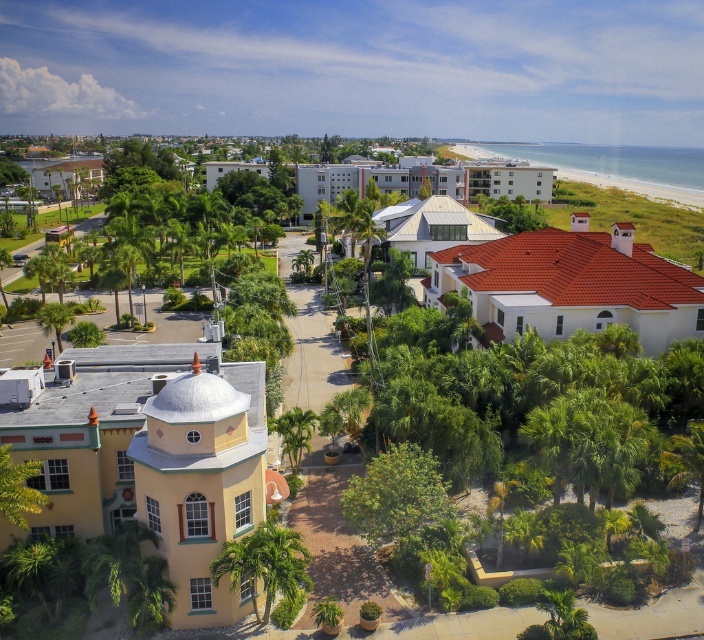
Question: Is white tile roof at upper right closer to the viewer compared to white concrete building at upper center?

Choices:
 (A) no
 (B) yes

Answer: (B)

Question: Which point appears farthest from the camera in this image?

Choices:
 (A) (65, 163)
 (B) (239, 568)
 (C) (264, 465)

Answer: (A)

Question: Is yellow matte building at lower left thinner than white concrete building at center?

Choices:
 (A) no
 (B) yes

Answer: (B)

Question: Does white concrete building at upper center appear on the left side of beige stucco hotel at upper left?

Choices:
 (A) no
 (B) yes

Answer: (A)

Question: Which point is farther to the camera?

Choices:
 (A) (120, 448)
 (B) (452, 198)
 (C) (260, 170)

Answer: (C)

Question: Which of the following is the farthest from the observer?

Choices:
 (A) (279, 544)
 (B) (84, 177)
 (C) (441, 225)
 (D) (149, 349)

Answer: (B)